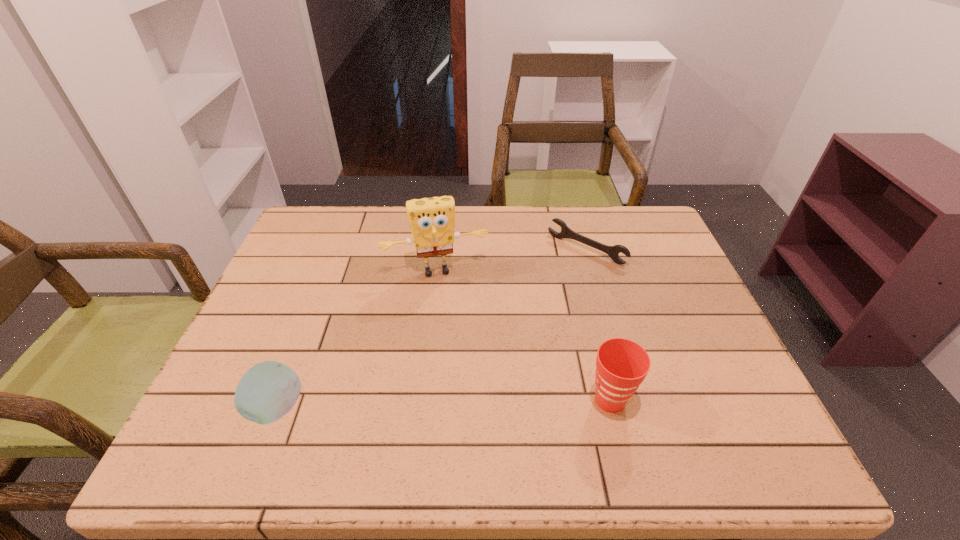
I want to click on object situated at the far right corner, so click(x=613, y=251).

You are a GUI agent. You are given a task and a screenshot of the screen. Output one action in this format:
    pyautogui.click(x=<x>, y=<y>)
    Task: Click on the vacant region at the far edge of the desktop
    This screenshot has width=960, height=540.
    Given the screenshot: What is the action you would take?
    pyautogui.click(x=558, y=228)

The height and width of the screenshot is (540, 960). In the image, there is a desktop. In order to click on vacant space at the near edge in this screenshot , I will do `click(540, 394)`.

In the image, there is a desktop. Identify the location of vacant space at the left edge. The height and width of the screenshot is (540, 960). (279, 326).

Locate an element on the screen. vacant position at the right edge of the desktop is located at coordinates (689, 281).

This screenshot has height=540, width=960. In order to click on vacant space at the far left corner of the desktop in this screenshot , I will do `click(316, 239)`.

At what (x,y) coordinates should I click in order to perform the action: click on free space at the far right corner of the desktop. Please return your answer as a coordinate pair (x, y). Looking at the image, I should click on (627, 216).

Identify the location of vacant point located between the tallest object and the shortest object. (511, 260).

Where is `vacant area that lies between the leftmost object and the third object from right to left`? This screenshot has height=540, width=960. vacant area that lies between the leftmost object and the third object from right to left is located at coordinates (356, 340).

This screenshot has height=540, width=960. I want to click on free area in between the second tallest object and the leftmost object, so click(x=444, y=404).